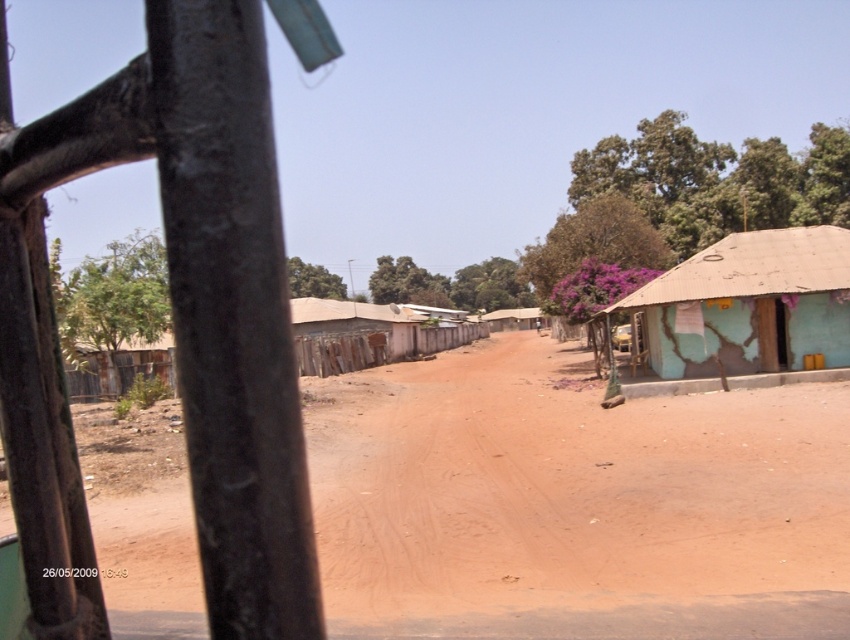
Does brown dirt field at center appear on the right side of teal cracked wall hut at right?

No, brown dirt field at center is not to the right of teal cracked wall hut at right.

Is point (754, 499) positioned after point (774, 234)?

No, (754, 499) is in front of (774, 234).

Is point (836, 403) positioned after point (822, 289)?

That is False.

This screenshot has width=850, height=640. I want to click on brown dirt field at center, so click(578, 506).